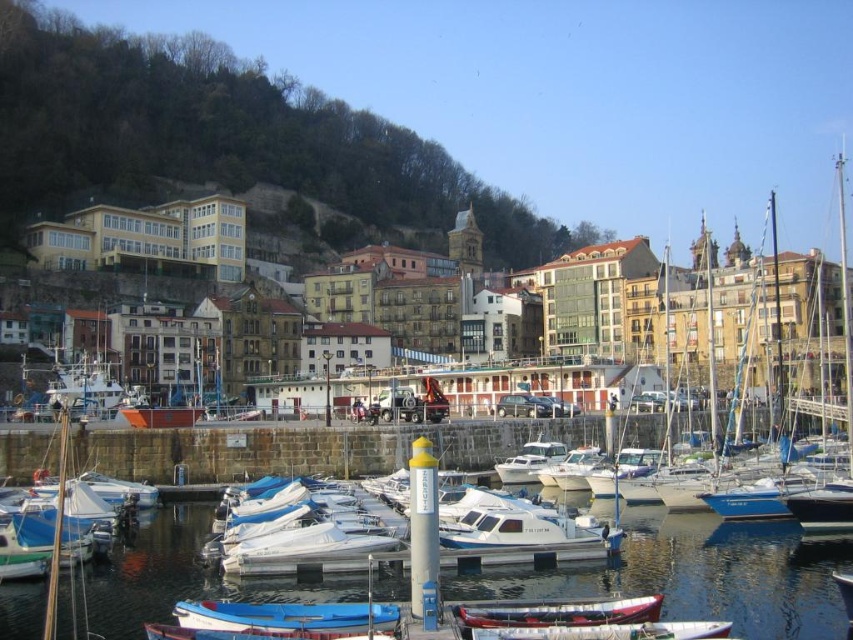
You are a tourist standing at the edge of the marina and want to take a photo of the white plastic boats at center and the white plastic boat at center. Which one appears closer to the camera in the photo?

The white plastic boats at center appears closer to the camera because it is positioned over the white plastic boat at center.

You are a tour guide leading a group of visitors to the harbor. You want to point out the white plastic boats at center and the white plastic boat at center to your group. How far apart are these two boats from each other?

The white plastic boats at center and the white plastic boat at center are 11.00 meters apart from each other.